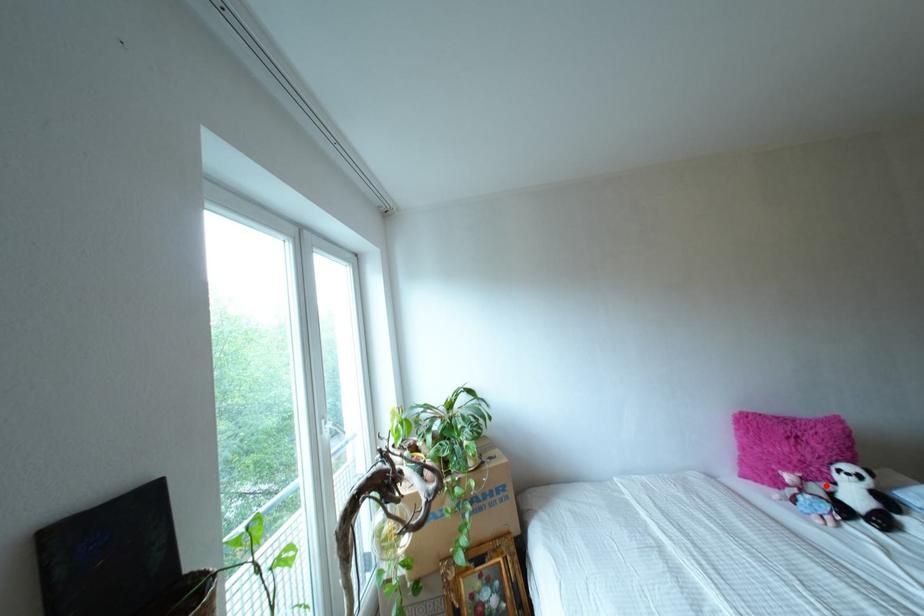
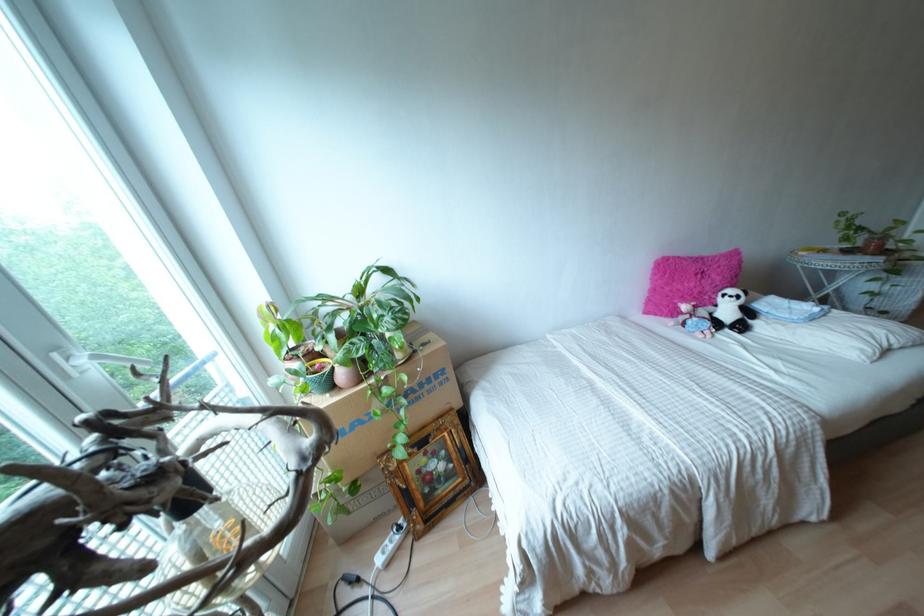
The point at the highlighted location is marked in the first image. Where is the corresponding point in the second image?

(710, 308)